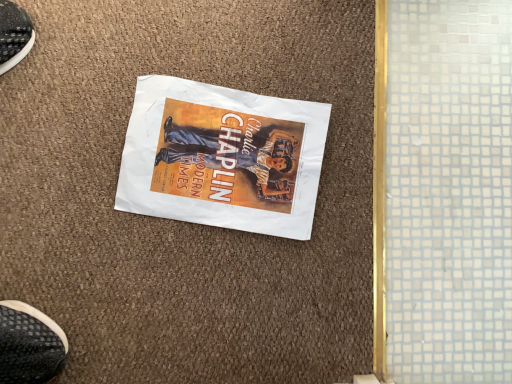
Identify the location of vacant area on top of matte paper poster at center (from a real-world perspective). (223, 158).